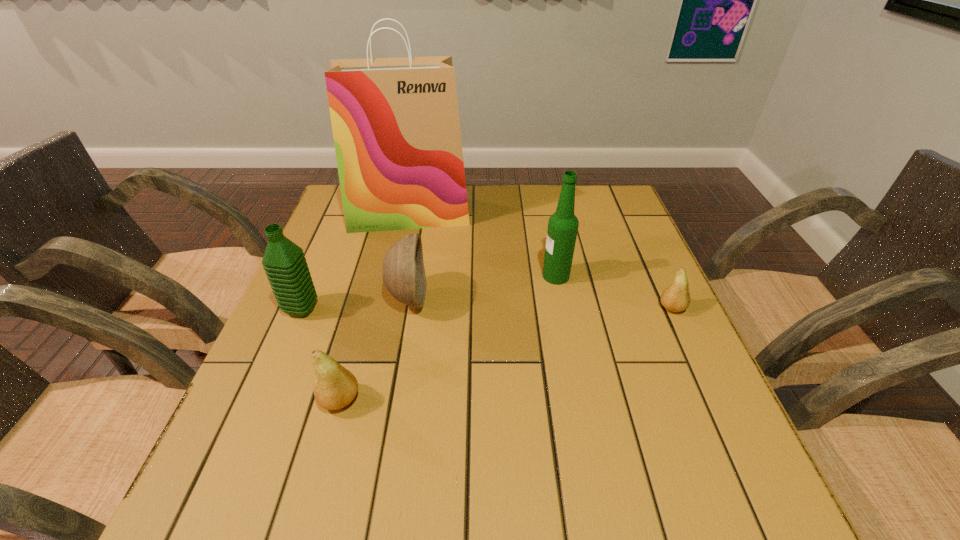
Image resolution: width=960 pixels, height=540 pixels. In order to click on free space located on the back of the taller pear in this screenshot , I will do `click(377, 264)`.

At what (x,y) coordinates should I click in order to perform the action: click on blank space located on the left of the right pear. Please return your answer as a coordinate pair (x, y). This screenshot has height=540, width=960. Looking at the image, I should click on (593, 308).

I want to click on vacant space located on the label of the second object from right to left, so click(x=397, y=276).

The height and width of the screenshot is (540, 960). Find the location of `free spot located 0.120m on the label of the second object from right to left`. free spot located 0.120m on the label of the second object from right to left is located at coordinates [494, 276].

Find the location of `free space located on the label of the second object from right to left`. free space located on the label of the second object from right to left is located at coordinates (494, 276).

Locate an element on the screen. vacant space located on the right of the tallest object is located at coordinates (582, 215).

This screenshot has height=540, width=960. Find the location of `vacant space located on the back of the bowl`. vacant space located on the back of the bowl is located at coordinates (418, 244).

This screenshot has width=960, height=540. I want to click on vacant space located on the back of the fourth shortest object, so click(337, 226).

The image size is (960, 540). I want to click on object situated at the far edge, so click(x=395, y=121).

Locate an element on the screen. This screenshot has height=540, width=960. object that is at the near edge is located at coordinates (335, 387).